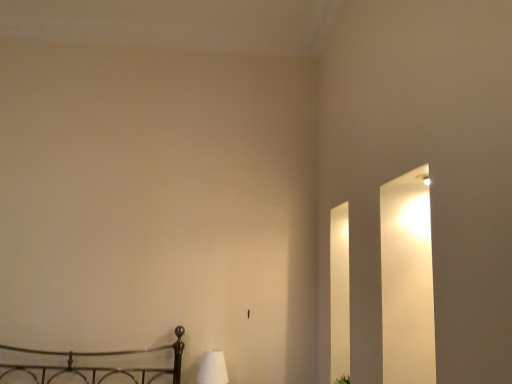
Question: Considering their positions, is white fabric lampshade at lower left located in front of or behind green leafy plant at lower right?

Choices:
 (A) front
 (B) behind

Answer: (B)

Question: Considering the positions of white fabric lampshade at lower left and green leafy plant at lower right in the image, is white fabric lampshade at lower left taller or shorter than green leafy plant at lower right?

Choices:
 (A) tall
 (B) short

Answer: (A)

Question: Would you say white fabric lampshade at lower left is to the left or to the right of green leafy plant at lower right in the picture?

Choices:
 (A) right
 (B) left

Answer: (B)

Question: Considering the positions of point (334, 382) and point (202, 380), is point (334, 382) closer or farther from the camera than point (202, 380)?

Choices:
 (A) closer
 (B) farther

Answer: (A)

Question: In terms of width, does green leafy plant at lower right look wider or thinner when compared to white fabric lampshade at lower left?

Choices:
 (A) wide
 (B) thin

Answer: (B)

Question: Considering the positions of green leafy plant at lower right and white fabric lampshade at lower left in the image, is green leafy plant at lower right bigger or smaller than white fabric lampshade at lower left?

Choices:
 (A) small
 (B) big

Answer: (A)

Question: Relative to white fabric lampshade at lower left, is green leafy plant at lower right in front or behind?

Choices:
 (A) front
 (B) behind

Answer: (A)